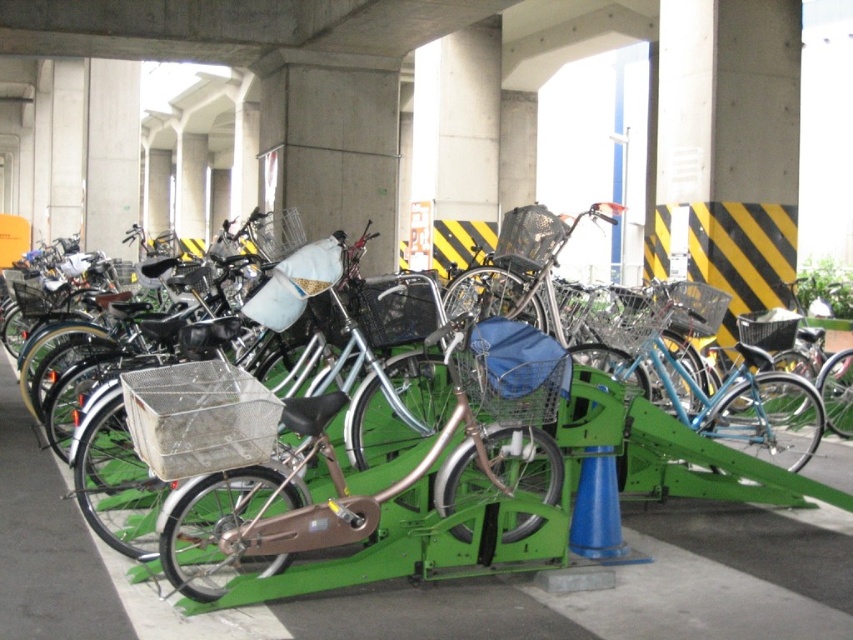
Question: Can you confirm if metallic silver bicycle at center is positioned below silver metallic bicycle at center?

Choices:
 (A) yes
 (B) no

Answer: (A)

Question: Which of the following is the farthest from the observer?

Choices:
 (A) (553, 442)
 (B) (643, 435)

Answer: (B)

Question: In this image, where is metallic silver bicycle at center located relative to silver metallic bicycle at center?

Choices:
 (A) left
 (B) right

Answer: (A)

Question: Can you confirm if metallic silver bicycle at center is positioned to the right of silver metallic bicycle at center?

Choices:
 (A) yes
 (B) no

Answer: (B)

Question: Among these objects, which one is farthest from the camera?

Choices:
 (A) metallic silver bicycle at center
 (B) silver metallic bicycle at center

Answer: (B)